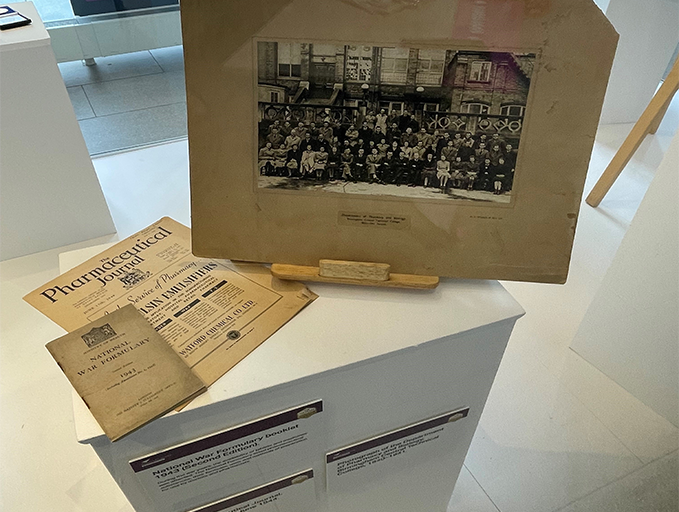
Where is `stand`? The height and width of the screenshot is (512, 679). stand is located at coordinates (299, 362).